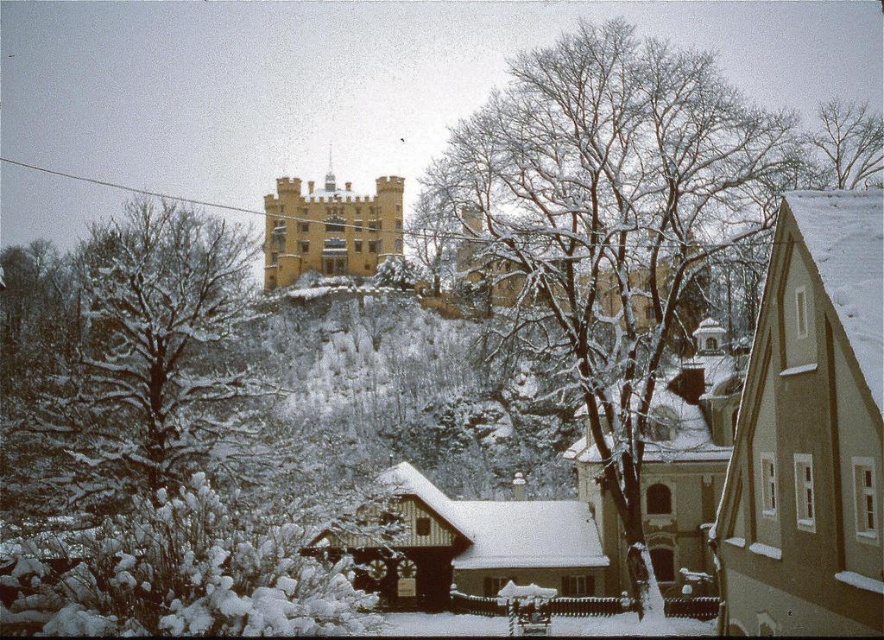
Question: Observing the image, what is the correct spatial positioning of snow-covered branches at center in reference to snowy bare branches at upper center?

Choices:
 (A) below
 (B) above

Answer: (A)

Question: Which point is closer to the camera?

Choices:
 (A) [747, 124]
 (B) [814, 132]

Answer: (A)

Question: Is snow-covered branches at center positioned in front of snowy bare branches at upper center?

Choices:
 (A) no
 (B) yes

Answer: (B)

Question: Which object appears closest to the camera in this image?

Choices:
 (A) snowy bare branches at upper center
 (B) snow-covered branches at center

Answer: (B)

Question: Is the position of snow-covered branches at center less distant than that of snowy bare branches at upper center?

Choices:
 (A) no
 (B) yes

Answer: (B)